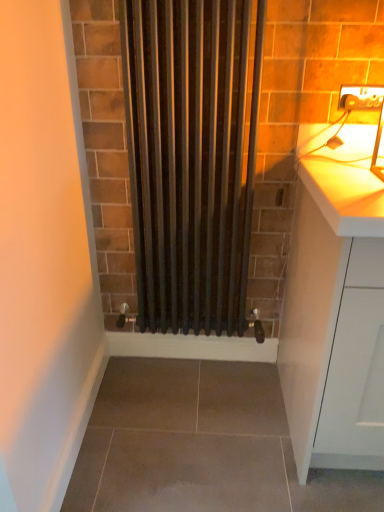
Question: Is point (367, 103) positioned closer to the camera than point (327, 159)?

Choices:
 (A) closer
 (B) farther

Answer: (B)

Question: Would you say matte white electric outlet at upper right is inside or outside white matte cabinet at right?

Choices:
 (A) outside
 (B) inside

Answer: (A)

Question: Which object is the farthest from the black matte radiator at center?

Choices:
 (A) matte white electric outlet at upper right
 (B) white matte cabinet at right

Answer: (A)

Question: Considering the real-world distances, which object is farthest from the matte white electric outlet at upper right?

Choices:
 (A) black matte radiator at center
 (B) white matte cabinet at right

Answer: (B)